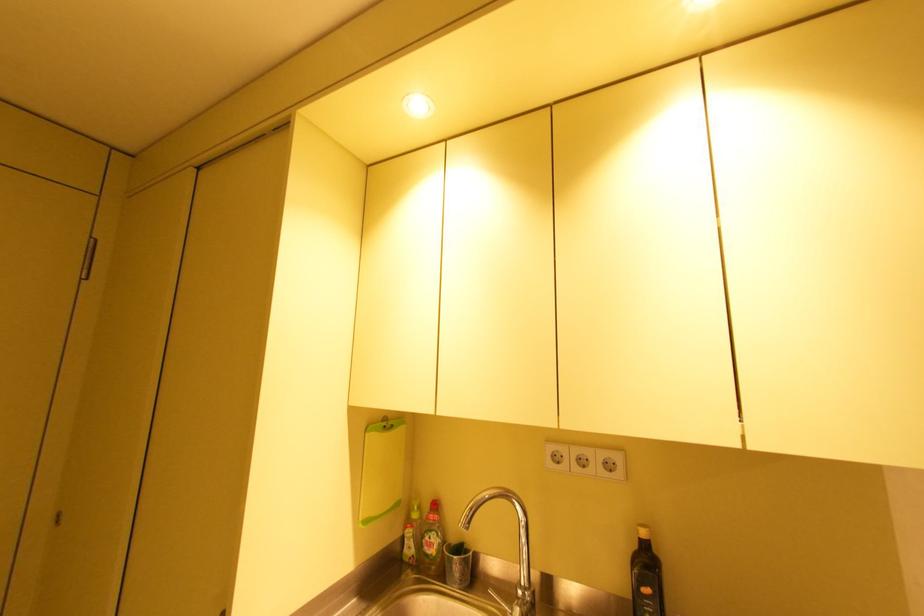
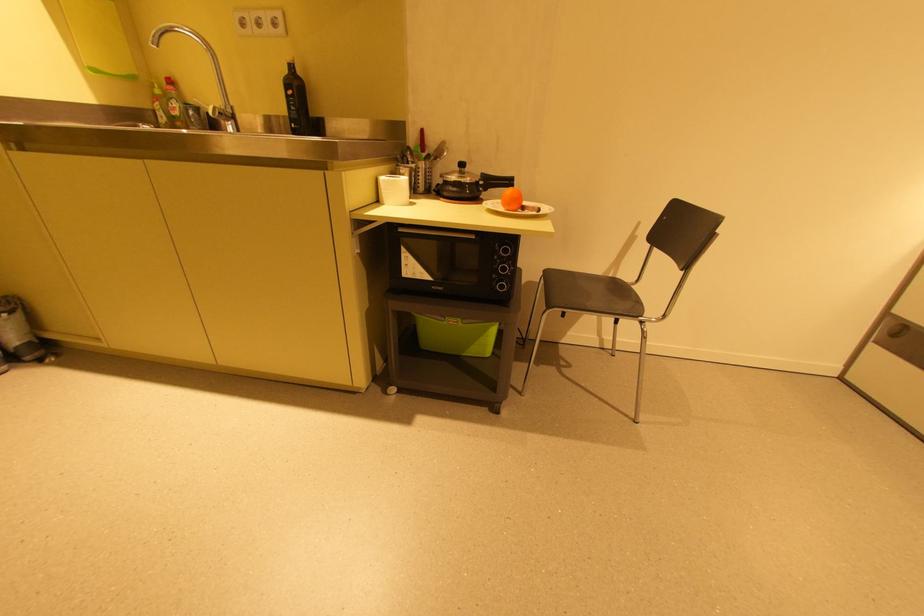
In the second image, find the point that corresponds to the point at 588,463 in the first image.

(263, 23)